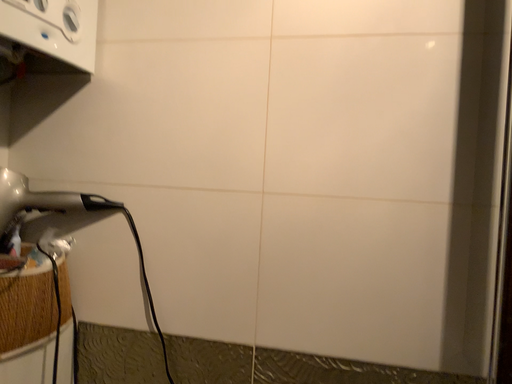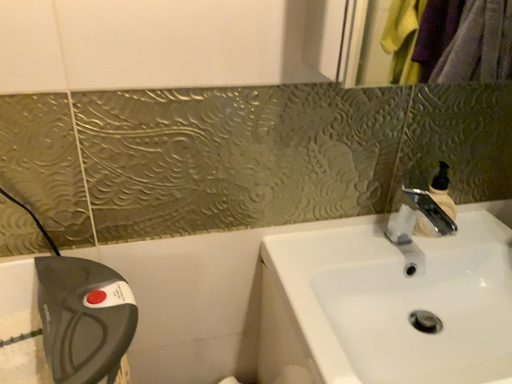
Question: How did the camera likely rotate when shooting the video?

Choices:
 (A) rotated left
 (B) rotated right

Answer: (B)